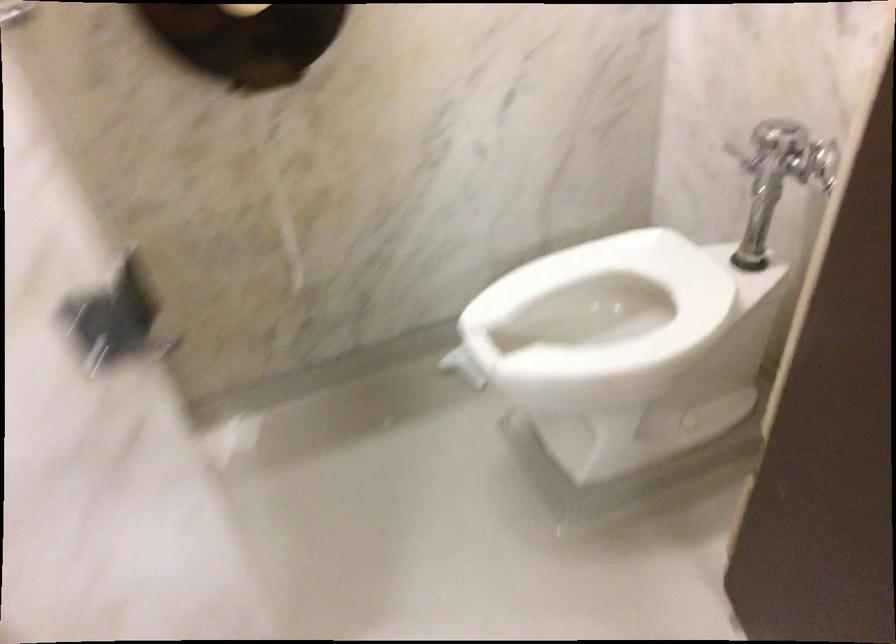
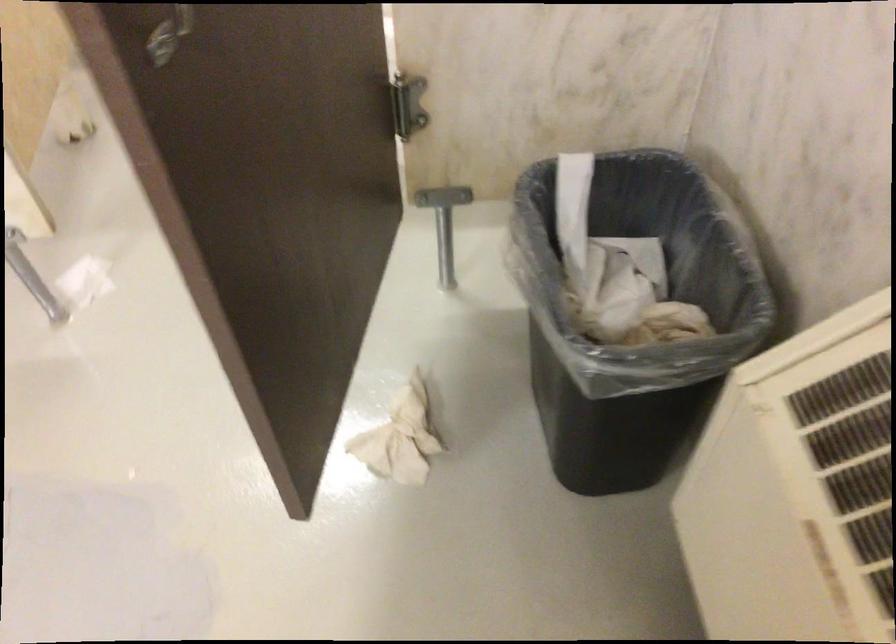
Question: The first image is from the beginning of the video and the second image is from the end. How did the camera likely rotate when shooting the video?

Choices:
 (A) Left
 (B) Right
 (C) Up
 (D) Down

Answer: (D)